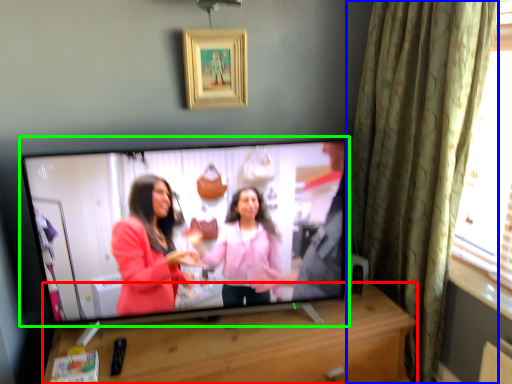
Question: Which is farther away from furniture (highlighted by a red box)? curtain (highlighted by a blue box) or television (highlighted by a green box)?

Choices:
 (A) curtain
 (B) television

Answer: (A)